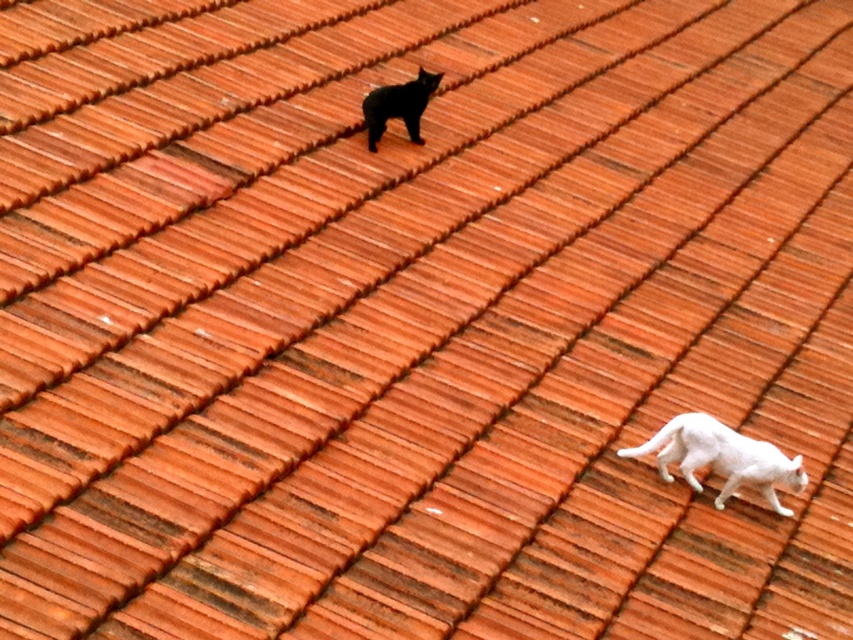
Question: Does white matte cat at lower right lie behind black matte cat at upper center?

Choices:
 (A) no
 (B) yes

Answer: (A)

Question: Is white matte cat at lower right positioned before black matte cat at upper center?

Choices:
 (A) yes
 (B) no

Answer: (A)

Question: From the image, what is the correct spatial relationship of white matte cat at lower right in relation to black matte cat at upper center?

Choices:
 (A) left
 (B) right

Answer: (B)

Question: Among these objects, which one is nearest to the camera?

Choices:
 (A) black matte cat at upper center
 (B) white matte cat at lower right

Answer: (B)

Question: Which point is closer to the camera?

Choices:
 (A) white matte cat at lower right
 (B) black matte cat at upper center

Answer: (A)